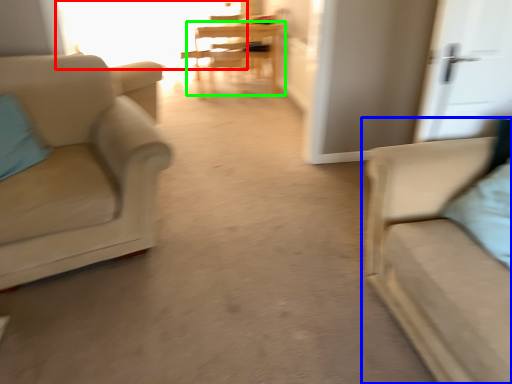
Question: Which object is the farthest from window (highlighted by a red box)? Choose among these: studio couch (highlighted by a blue box) or table (highlighted by a green box).

Choices:
 (A) studio couch
 (B) table

Answer: (A)